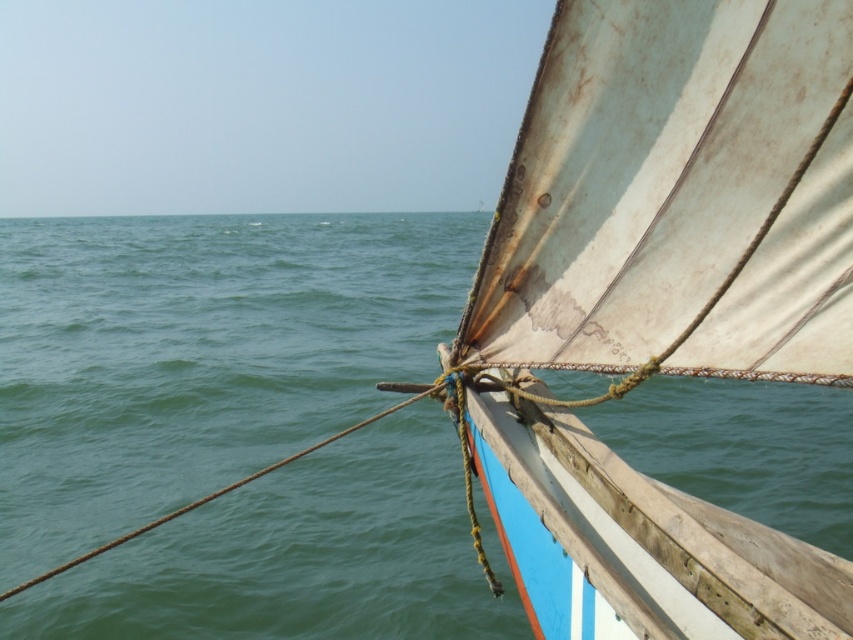
Question: Does green water at center lie behind white tattered sail at upper right?

Choices:
 (A) yes
 (B) no

Answer: (A)

Question: Which point is farther to the camera?

Choices:
 (A) green water at center
 (B) white tattered sail at upper right

Answer: (A)

Question: Does green water at center have a lesser width compared to white tattered sail at upper right?

Choices:
 (A) no
 (B) yes

Answer: (A)

Question: Can you confirm if green water at center is smaller than white tattered sail at upper right?

Choices:
 (A) yes
 (B) no

Answer: (B)